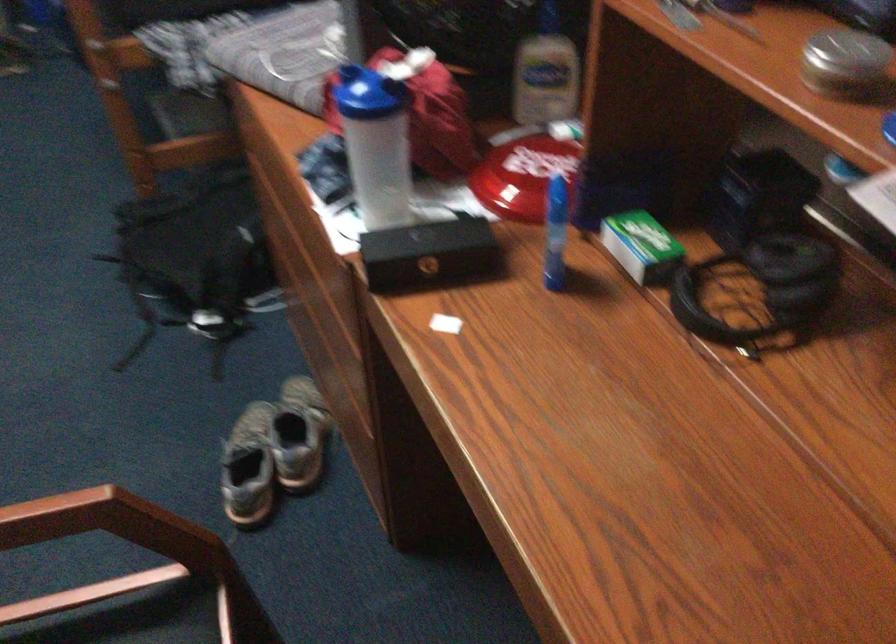
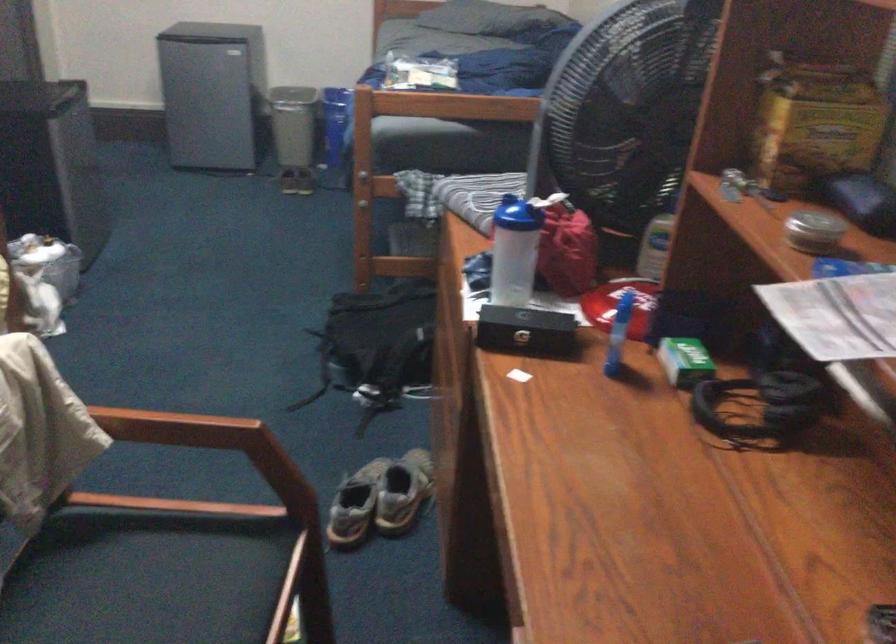
Find the pixel in the second image that matches point (246, 469) in the first image.

(355, 505)